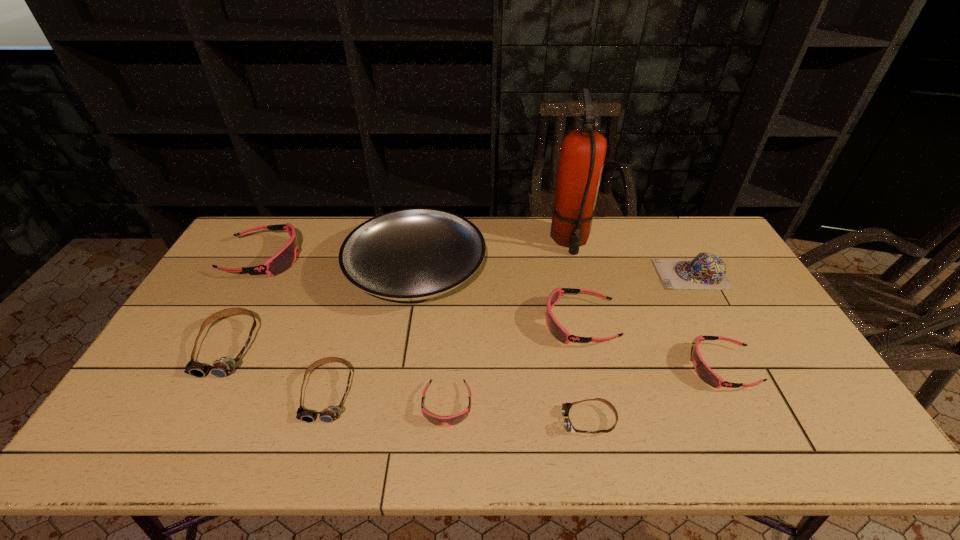
Find the location of `object that is the fifth closest to the biggest brown goggles`. object that is the fifth closest to the biggest brown goggles is located at coordinates (557, 330).

Locate an element on the screen. The height and width of the screenshot is (540, 960). goggles that is the closest to the rightmost pink goggles is located at coordinates (557, 330).

Image resolution: width=960 pixels, height=540 pixels. I want to click on goggles that is the third closest to the farthest pink goggles, so click(x=453, y=420).

Find the location of a particular element. This screenshot has height=540, width=960. pink goggles that is the second closest to the cap is located at coordinates (703, 371).

This screenshot has height=540, width=960. Find the location of `the third closest pink goggles relative to the fire extinguisher`. the third closest pink goggles relative to the fire extinguisher is located at coordinates (453, 420).

Identify the location of brown goggles that is the second closest to the biggest brown goggles. (568, 426).

The image size is (960, 540). What are the coordinates of `the closest brown goggles to the rightmost brown goggles` in the screenshot? It's located at (331, 413).

In order to click on vacant area that satisfies the following two spatial constraints: 1. on the front, side, and top of the cap; 2. on the front-facing side of the smallest pink goggles in this screenshot , I will do `click(761, 405)`.

Identify the location of vacant position in the image that satisfies the following two spatial constraints: 1. on the front-facing side of the third pink goggles from left to right; 2. on the front-facing side of the second brown goggles from right to left. (596, 393).

This screenshot has width=960, height=540. Find the location of `vacant space that satisfies the following two spatial constraints: 1. on the nozzle of the tallest object; 2. on the front-facing side of the rightmost brown goggles`. vacant space that satisfies the following two spatial constraints: 1. on the nozzle of the tallest object; 2. on the front-facing side of the rightmost brown goggles is located at coordinates (614, 421).